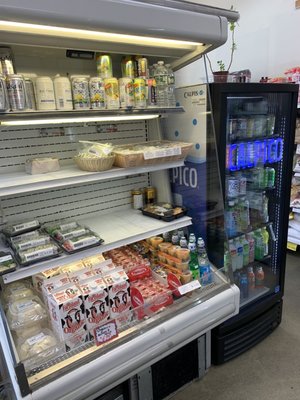
You are a GUI agent. You are given a task and a screenshot of the screen. Output one action in this format:
    pyautogui.click(x=<x>, y=<y>)
    Task: Click on the reflections in glass door of cooler
    
    Given the screenshot: What is the action you would take?
    pyautogui.click(x=254, y=200)